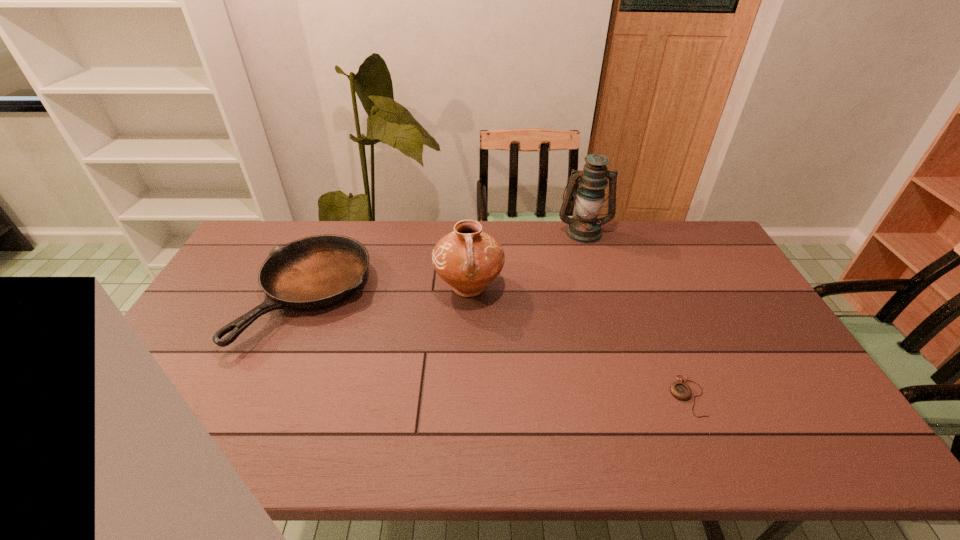
At what (x,y) coordinates should I click in order to perform the action: click on free point between the oil lamp and the shortest object. Please return your answer as a coordinate pair (x, y). This screenshot has height=540, width=960. Looking at the image, I should click on (636, 314).

You are a GUI agent. You are given a task and a screenshot of the screen. Output one action in this format:
    pyautogui.click(x=<x>, y=<y>)
    Task: Click on the empty space between the pottery and the tallest object
    Image resolution: width=960 pixels, height=540 pixels.
    Given the screenshot: What is the action you would take?
    pyautogui.click(x=526, y=260)

Where is `unoccupied area between the leftmost object and the second object from left to right`? The height and width of the screenshot is (540, 960). unoccupied area between the leftmost object and the second object from left to right is located at coordinates (389, 292).

Identify the location of free spot between the farthest object and the third shortest object. (526, 260).

In order to click on free spot between the second object from left to right and the shortest object in this screenshot , I will do `click(579, 342)`.

Find the location of `free space that is in between the pocket watch and the third object from right to left`. free space that is in between the pocket watch and the third object from right to left is located at coordinates (579, 342).

Where is `free space between the tallest object and the pottery`? free space between the tallest object and the pottery is located at coordinates (526, 260).

The width and height of the screenshot is (960, 540). Find the location of `free space between the pottery and the shortest object`. free space between the pottery and the shortest object is located at coordinates (579, 342).

Locate an element on the screen. This screenshot has height=540, width=960. object that is the closest to the third object from right to left is located at coordinates (316, 272).

Select which object is the second closest to the frying pan. Please provide its 2D coordinates. Your answer should be formatted as a tuple, i.e. [(x, y)], where the tuple contains the x and y coordinates of a point satisfying the conditions above.

[(584, 227)]